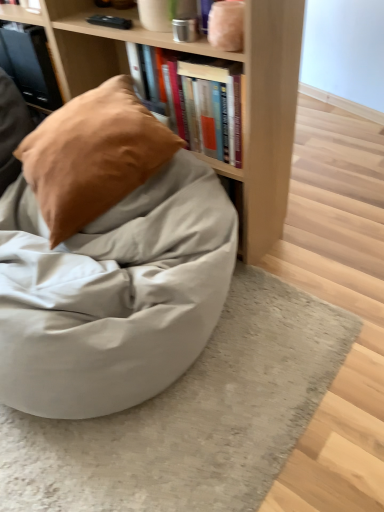
Question: Would you say matte gray bean bag at center is to the left or to the right of suede-like tan pillow at upper left in the picture?

Choices:
 (A) left
 (B) right

Answer: (A)

Question: Based on their sizes in the image, would you say matte gray bean bag at center is bigger or smaller than suede-like tan pillow at upper left?

Choices:
 (A) small
 (B) big

Answer: (B)

Question: Estimate the real-world distances between objects in this image. Which object is farther from the matte black book at upper left, which ranks as the second book in bottom-to-top order?

Choices:
 (A) matte gray bean bag at center
 (B) hardcover books at upper center, arranged as the 2th book when viewed from the back
 (C) light wood bookcase at upper center
 (D) suede-like tan pillow at upper left

Answer: (B)

Question: Based on their relative distances, which object is nearer to the matte black book at upper left, which is the 1th book in back-to-front order?

Choices:
 (A) matte gray bean bag at center
 (B) hardcover books at upper center, the first book in the front-to-back sequence
 (C) suede-like tan pillow at upper left
 (D) light wood bookcase at upper center

Answer: (D)